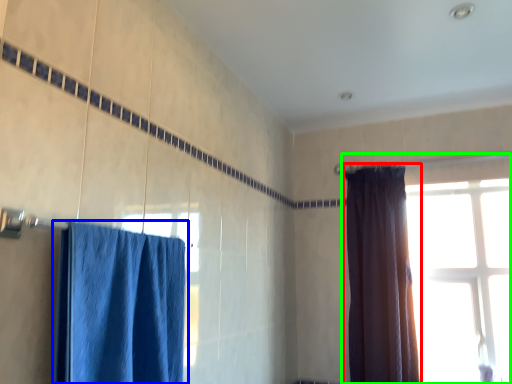
Question: Estimate the real-world distances between objects in this image. Which object is farther from curtain (highlighted by a red box), curtain (highlighted by a blue box) or window (highlighted by a green box)?

Choices:
 (A) curtain
 (B) window

Answer: (A)